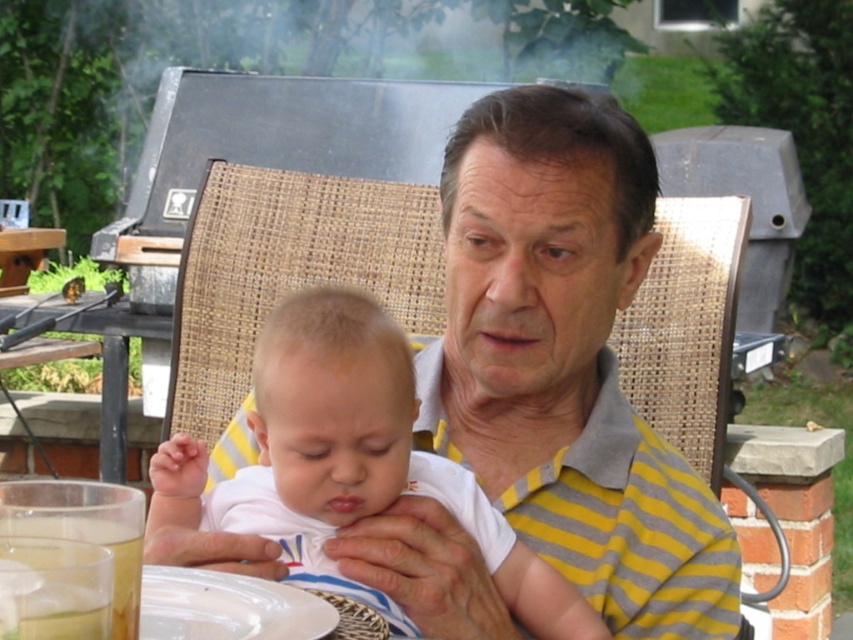
You are a photographer trying to capture a closeup of the white cotton baby at center and the translucent plastic cup at lower left. Since you want both objects to appear similar in size in the photo, which object should you move closer to the camera?

You should move the translucent plastic cup at lower left closer to the camera because the white cotton baby at center is wider than the translucent plastic cup at lower left. To make them appear the same size in the photo, the smaller object needs to be moved closer.